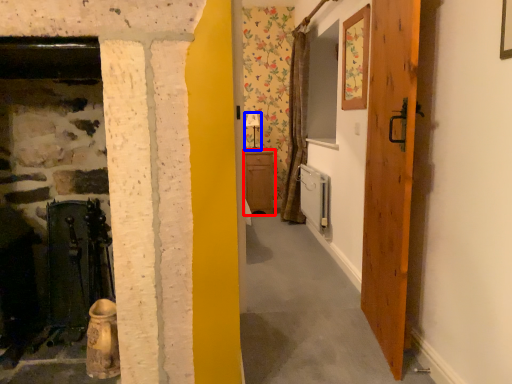
Question: Which object appears farthest to the camera in this image, cabinetry (highlighted by a red box) or lamp (highlighted by a blue box)?

Choices:
 (A) cabinetry
 (B) lamp

Answer: (B)